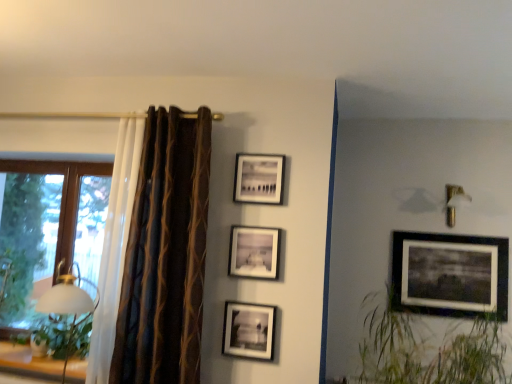
How much space does matte black picture frame at center, the fourth picture frame in the back-to-front sequence, occupy vertically?

The height of matte black picture frame at center, the fourth picture frame in the back-to-front sequence, is 13.91 inches.

The image size is (512, 384). Describe the element at coordinates (454, 202) in the screenshot. I see `gold metallic wall sconce at upper right` at that location.

Where is `matte black picture frame at upper center, the third picture frame positioned from the left`? matte black picture frame at upper center, the third picture frame positioned from the left is located at coordinates (259, 178).

What do you see at coordinates (450, 274) in the screenshot?
I see `matte black picture frame at right, marked as the first picture frame in a right-to-left arrangement` at bounding box center [450, 274].

In order to face white glossy table lamp at left, should I rotate leftwards or rightwards?

You should look left and rotate roughly 23.975 degrees.

Describe the element at coordinates (426, 350) in the screenshot. The width and height of the screenshot is (512, 384). I see `green grass at right` at that location.

What do you see at coordinates (165, 254) in the screenshot?
I see `brown striped curtain at left` at bounding box center [165, 254].

I want to click on matte black picture frame at center, the 4th picture frame positioned from the right, so click(249, 330).

Between brown striped curtain at left and white glossy table lamp at left, which one is positioned behind?

brown striped curtain at left is behind.

Considering the positions of objects brown striped curtain at left and white glossy table lamp at left in the image provided, who is more to the right, brown striped curtain at left or white glossy table lamp at left?

From the viewer's perspective, brown striped curtain at left appears more on the right side.

Considering the sizes of objects brown striped curtain at left and white glossy table lamp at left in the image provided, who is smaller, brown striped curtain at left or white glossy table lamp at left?

white glossy table lamp at left.

Considering the relative sizes of brown striped curtain at left and white glossy table lamp at left in the image provided, is brown striped curtain at left thinner than white glossy table lamp at left?

Yes, brown striped curtain at left is thinner than white glossy table lamp at left.

Based on their sizes in the image, would you say green leafy plant at left is bigger or smaller than white glossy table lamp at left?

Considering their sizes, green leafy plant at left takes up less space than white glossy table lamp at left.

In the scene shown: Considering the sizes of objects green leafy plant at left and white glossy table lamp at left in the image provided, who is thinner, green leafy plant at left or white glossy table lamp at left?

white glossy table lamp at left is thinner.

In the image, there is a green leafy plant at left. Identify the location of table lamp above it (from the image's perspective). (67, 303).

How distant is green leafy plant at left from white glossy table lamp at left?

green leafy plant at left is 6.16 inches from white glossy table lamp at left.

Does green leafy plant at left have a lesser width compared to matte black picture frame at right, which is the 4th picture frame from left to right?

No.

Where is `plant lying below the matte black picture frame at right, the 4th picture frame in the front-to-back sequence (from the image's perspective)`? This screenshot has height=384, width=512. plant lying below the matte black picture frame at right, the 4th picture frame in the front-to-back sequence (from the image's perspective) is located at coordinates (52, 334).

Is green leafy plant at left turned away from matte black picture frame at right, the 4th picture frame in the front-to-back sequence?

No, green leafy plant at left is not facing away from matte black picture frame at right, the 4th picture frame in the front-to-back sequence.

In terms of size, does green leafy plant at left appear bigger or smaller than matte black picture frame at right, which is the 4th picture frame from left to right?

green leafy plant at left is bigger than matte black picture frame at right, which is the 4th picture frame from left to right.

Where is `table lamp below the gold metallic wall sconce at upper right (from the image's perspective)`? This screenshot has height=384, width=512. table lamp below the gold metallic wall sconce at upper right (from the image's perspective) is located at coordinates (67, 303).

In the image, is gold metallic wall sconce at upper right positioned in front of or behind white glossy table lamp at left?

Visually, gold metallic wall sconce at upper right is located behind white glossy table lamp at left.

Which is closer to the camera, (452, 212) or (62, 383)?

Point (452, 212) is positioned farther from the camera compared to point (62, 383).

Consider the image. Is gold metallic wall sconce at upper right not near white glossy table lamp at left?

gold metallic wall sconce at upper right is positioned a significant distance from white glossy table lamp at left.

From a real-world perspective, which object stands above the other?

brown striped curtain at left is physically above.

From the image's perspective, is green leafy plant at left above brown striped curtain at left?

→ No, from the image's perspective, green leafy plant at left is not on top of brown striped curtain at left.

Is green leafy plant at left taller than brown striped curtain at left?

Incorrect, the height of green leafy plant at left is not larger of that of brown striped curtain at left.

Is green leafy plant at left to the left or to the right of brown striped curtain at left in the image?

From the image, it's evident that green leafy plant at left is to the left of brown striped curtain at left.

Which of these two, green leafy plant at left or green grass at right, stands shorter?

green leafy plant at left is shorter.

How different are the orientations of green leafy plant at left and green grass at right in degrees?

They differ by 0.000352 degrees in their facing directions.

Is point (56, 345) farther from camera compared to point (405, 348)?

That is True.

Between green leafy plant at left and green grass at right, which one has larger width?

With larger width is green grass at right.

Could you tell me if matte black picture frame at center, arranged as the 3th picture frame when viewed from the right, is turned towards matte black picture frame at center, the 4th picture frame positioned from the right?

No, matte black picture frame at center, arranged as the 3th picture frame when viewed from the right, is not turned towards matte black picture frame at center, the 4th picture frame positioned from the right.

From a real-world perspective, is matte black picture frame at center, which is counted as the 2th picture frame, starting from the front, located higher than matte black picture frame at center, which is the 1th picture frame in front-to-back order?

Yes, from a real-world perspective, matte black picture frame at center, which is counted as the 2th picture frame, starting from the front, is above matte black picture frame at center, which is the 1th picture frame in front-to-back order.

Is matte black picture frame at center, the second picture frame in the left-to-right sequence, wider or thinner than matte black picture frame at center, which appears as the first picture frame when viewed from the left?

In the image, matte black picture frame at center, the second picture frame in the left-to-right sequence, appears to be wider than matte black picture frame at center, which appears as the first picture frame when viewed from the left.

Considering the positions of point (272, 270) and point (223, 340), is point (272, 270) closer or farther from the camera than point (223, 340)?

Point (272, 270) is closer to the camera than point (223, 340).

Locate an element on the screen. Image resolution: width=512 pixels, height=384 pixels. table lamp in front of the brown striped curtain at left is located at coordinates coord(67,303).

Locate an element on the screen. plant that is on the left side of white glossy table lamp at left is located at coordinates (52, 334).

Looking at the image, which one is located closer to matte black picture frame at right, which is the 4th picture frame from left to right, brown striped curtain at left or gold metallic wall sconce at upper right?

The object closer to matte black picture frame at right, which is the 4th picture frame from left to right, is gold metallic wall sconce at upper right.

From the image, which object appears to be nearer to matte black picture frame at center, arranged as the 3th picture frame when viewed from the right, matte black picture frame at center, the fourth picture frame in the back-to-front sequence, or wooden frame window at left?

matte black picture frame at center, the fourth picture frame in the back-to-front sequence, is positioned closer to the anchor matte black picture frame at center, arranged as the 3th picture frame when viewed from the right.

Which object lies further to the anchor point green grass at right, matte black picture frame at right, positioned as the 1th picture frame in back-to-front order, or matte black picture frame at center, which appears as the first picture frame when viewed from the left?

matte black picture frame at center, which appears as the first picture frame when viewed from the left, lies further to green grass at right than the other object.

Based on their spatial positions, is gold metallic wall sconce at upper right or matte black picture frame at upper center, the third picture frame positioned from the left, closer to matte black picture frame at center, which is the 1th picture frame in front-to-back order?

Based on the image, matte black picture frame at upper center, the third picture frame positioned from the left, appears to be nearer to matte black picture frame at center, which is the 1th picture frame in front-to-back order.

Looking at the image, which one is located further to wooden frame window at left, brown striped curtain at left or matte black picture frame at center, the fourth picture frame in the back-to-front sequence?

Among the two, matte black picture frame at center, the fourth picture frame in the back-to-front sequence, is located further to wooden frame window at left.

Looking at the image, which one is located further to matte black picture frame at center, which appears as the first picture frame when viewed from the left, white glossy table lamp at left or matte black picture frame at right, marked as the first picture frame in a right-to-left arrangement?

The object further to matte black picture frame at center, which appears as the first picture frame when viewed from the left, is matte black picture frame at right, marked as the first picture frame in a right-to-left arrangement.

Looking at the image, which one is located closer to matte black picture frame at upper center, which is the second picture frame in right-to-left order, brown striped curtain at left or green leafy plant at left?

The object closer to matte black picture frame at upper center, which is the second picture frame in right-to-left order, is brown striped curtain at left.

From the image, which object appears to be farther from gold metallic wall sconce at upper right, green leafy plant at left or wooden frame window at left?

Among the two, wooden frame window at left is located further to gold metallic wall sconce at upper right.

This screenshot has width=512, height=384. I want to click on lamp between green grass at right and matte black picture frame at right, the 4th picture frame in the front-to-back sequence, from front to back, so click(454, 202).

The width and height of the screenshot is (512, 384). I want to click on picture frame located between wooden frame window at left and matte black picture frame at center, which is counted as the 2th picture frame, starting from the front, in the left-right direction, so click(x=249, y=330).

The width and height of the screenshot is (512, 384). I want to click on table lamp between wooden frame window at left and brown striped curtain at left in the horizontal direction, so click(x=67, y=303).

Identify the location of table lamp located between wooden frame window at left and matte black picture frame at center, the second picture frame in the left-to-right sequence, in the left-right direction. (67, 303).